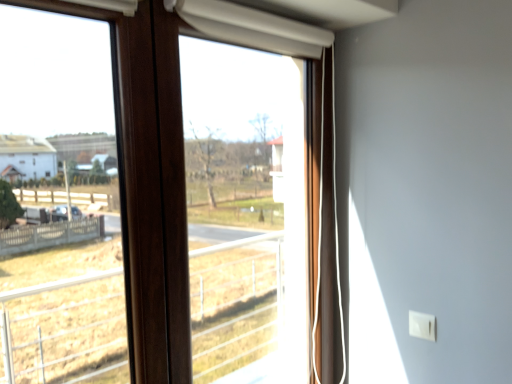
Question: Is wooden frame at center not near transparent plastic window screen at center?

Choices:
 (A) yes
 (B) no

Answer: (B)

Question: Considering the relative sizes of wooden frame at center and transparent plastic window screen at center in the image provided, is wooden frame at center smaller than transparent plastic window screen at center?

Choices:
 (A) no
 (B) yes

Answer: (A)

Question: From a real-world perspective, is wooden frame at center physically above transparent plastic window screen at center?

Choices:
 (A) yes
 (B) no

Answer: (A)

Question: Would you say wooden frame at center is outside transparent plastic window screen at center?

Choices:
 (A) no
 (B) yes

Answer: (A)

Question: Is wooden frame at center closer to camera compared to transparent plastic window screen at center?

Choices:
 (A) yes
 (B) no

Answer: (A)

Question: Could you tell me if wooden frame at center is facing transparent plastic window screen at center?

Choices:
 (A) yes
 (B) no

Answer: (A)

Question: Could wooden frame at center be considered to be inside transparent plastic window screen at center?

Choices:
 (A) no
 (B) yes

Answer: (B)

Question: From the image's perspective, is transparent plastic window screen at center beneath wooden frame at center?

Choices:
 (A) no
 (B) yes

Answer: (A)

Question: Does transparent plastic window screen at center come in front of wooden frame at center?

Choices:
 (A) yes
 (B) no

Answer: (B)

Question: Considering the relative positions of transparent plastic window screen at center and wooden frame at center in the image provided, is transparent plastic window screen at center to the left of wooden frame at center from the viewer's perspective?

Choices:
 (A) no
 (B) yes

Answer: (A)

Question: Can we say transparent plastic window screen at center lies outside wooden frame at center?

Choices:
 (A) yes
 (B) no

Answer: (B)

Question: Is transparent plastic window screen at center aimed at wooden frame at center?

Choices:
 (A) no
 (B) yes

Answer: (B)

Question: Is wooden frame at center inside or outside of transparent plastic window screen at center?

Choices:
 (A) outside
 (B) inside

Answer: (B)